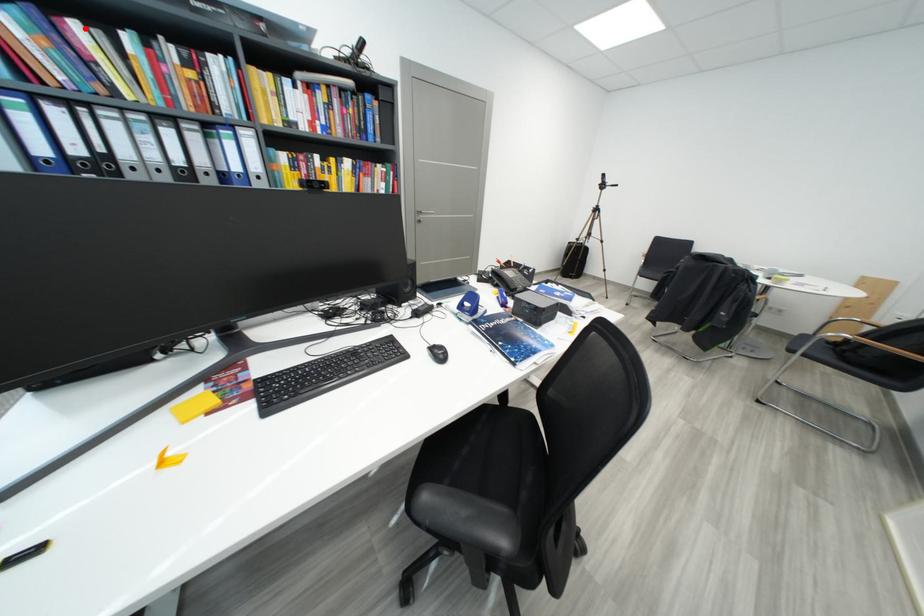
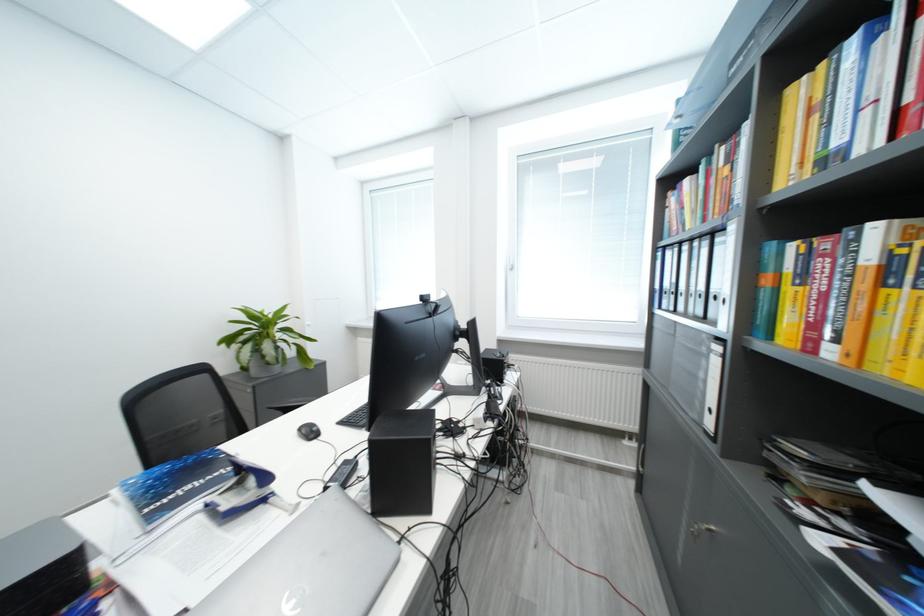
Where in the second image is the point corresponding to the highlighted location from the first image?

(696, 184)